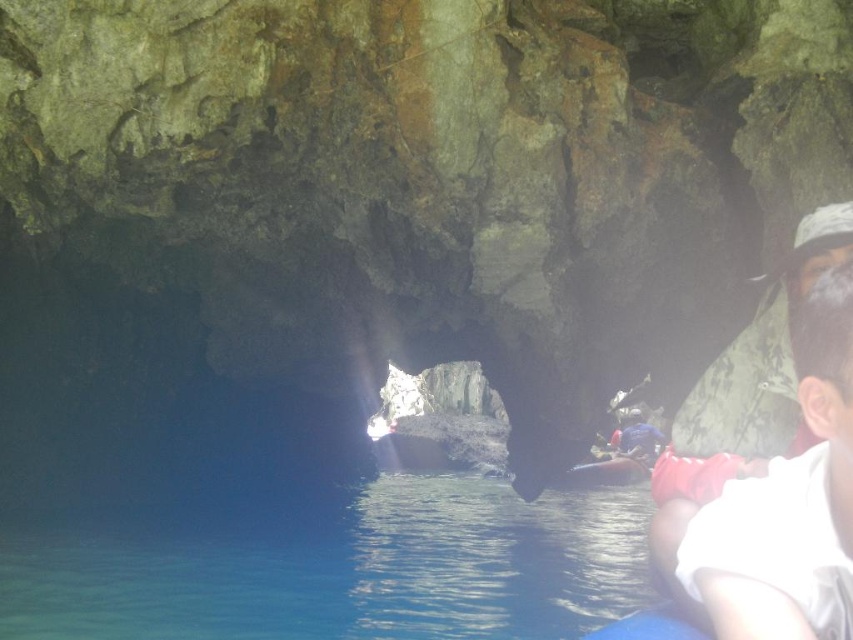
Question: Which point is farther from the camera taking this photo?

Choices:
 (A) (717, 548)
 (B) (210, 621)

Answer: (B)

Question: Which point is farther from the camera taking this photo?

Choices:
 (A) (825, 637)
 (B) (561, 625)

Answer: (B)

Question: Which point appears closest to the camera in this image?

Choices:
 (A) (544, 604)
 (B) (734, 592)

Answer: (B)

Question: Can you confirm if blue clear water at lower left is thinner than white matte shirt at right?

Choices:
 (A) yes
 (B) no

Answer: (B)

Question: Does blue clear water at lower left appear on the left side of white matte shirt at right?

Choices:
 (A) no
 (B) yes

Answer: (B)

Question: Does blue clear water at lower left come in front of white matte shirt at right?

Choices:
 (A) yes
 (B) no

Answer: (B)